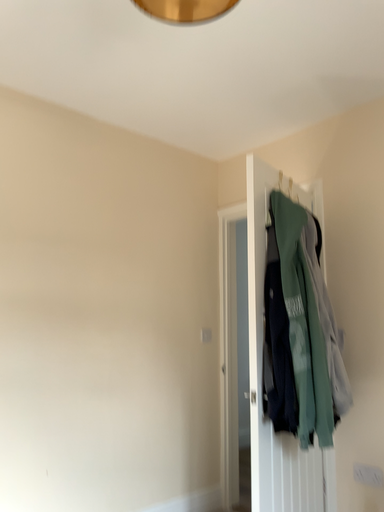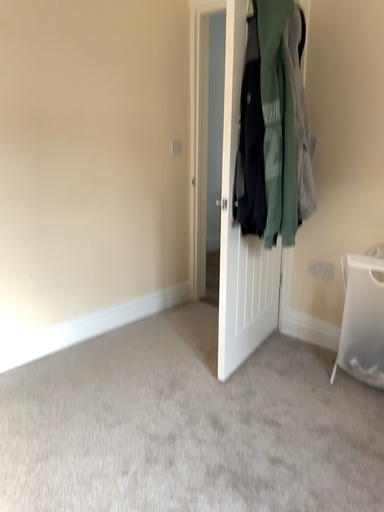
Question: Which way did the camera rotate in the video?

Choices:
 (A) rotated downward
 (B) rotated upward

Answer: (A)